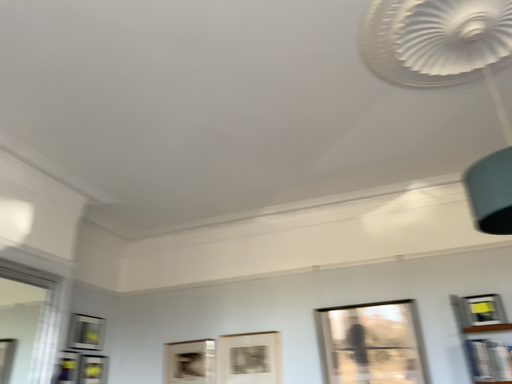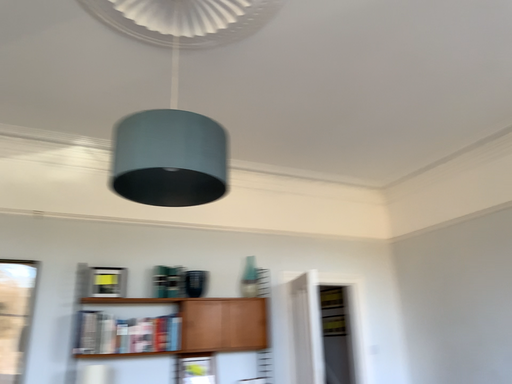
Question: Which way did the camera rotate in the video?

Choices:
 (A) rotated upward
 (B) rotated downward

Answer: (B)